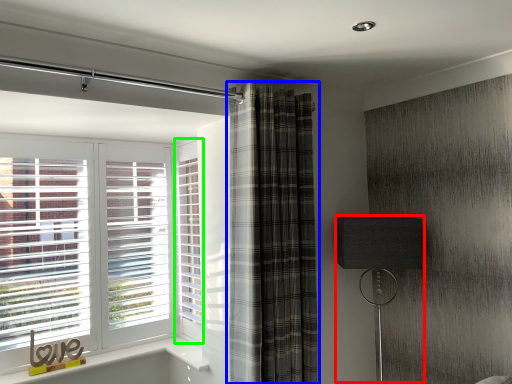
Question: Based on their relative distances, which object is nearer to table lamp (highlighted by a red box)? Choose from curtain (highlighted by a blue box) and screen door (highlighted by a green box).

Choices:
 (A) curtain
 (B) screen door

Answer: (A)